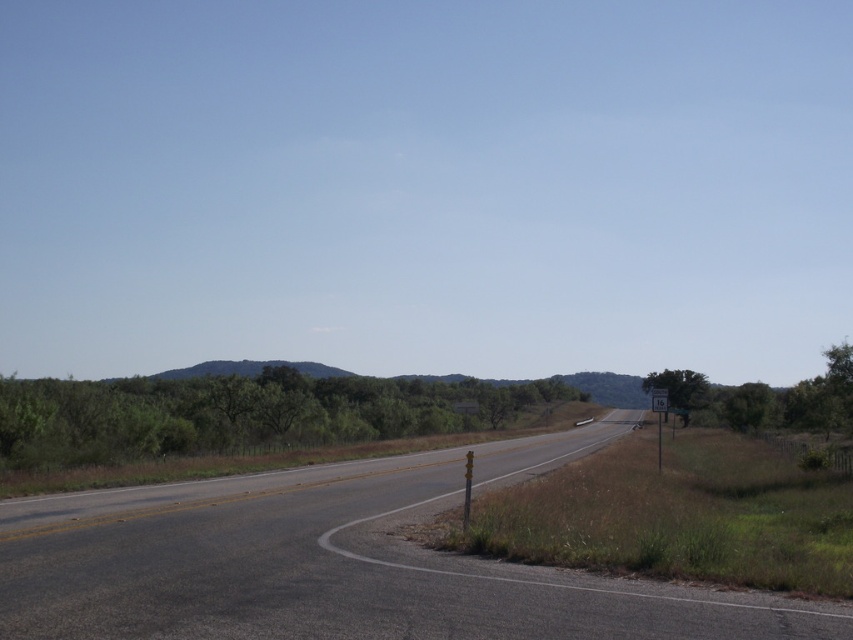
Who is positioned more to the right, asphalt road at center or yellow metal speed limit sign at right?

yellow metal speed limit sign at right

Does asphalt road at center come in front of yellow metal speed limit sign at right?

Yes, it is.

Where is `asphalt road at center`? The width and height of the screenshot is (853, 640). asphalt road at center is located at coordinates (329, 570).

Can you confirm if green leafy tree at right is positioned to the right of yellow metal speed limit sign at right?

Correct, you'll find green leafy tree at right to the right of yellow metal speed limit sign at right.

Between point (680, 413) and point (663, 406), which one is positioned behind?

The point (680, 413) is behind.

Does point (683, 392) come farther from viewer compared to point (654, 406)?

Yes, point (683, 392) is behind point (654, 406).

You are a GUI agent. You are given a task and a screenshot of the screen. Output one action in this format:
    pyautogui.click(x=<x>, y=<y>)
    Task: Click on the green leafy tree at right
    
    Given the screenshot: What is the action you would take?
    pyautogui.click(x=679, y=388)

Does point (97, 392) come closer to viewer compared to point (660, 392)?

No.

Can you confirm if green leafy trees at center is shorter than yellow metal speed limit sign at right?

In fact, green leafy trees at center may be taller than yellow metal speed limit sign at right.

Who is more distant from viewer, (360, 403) or (656, 403)?

The point (360, 403) is behind.

Where is `green leafy trees at center`? green leafy trees at center is located at coordinates (247, 413).